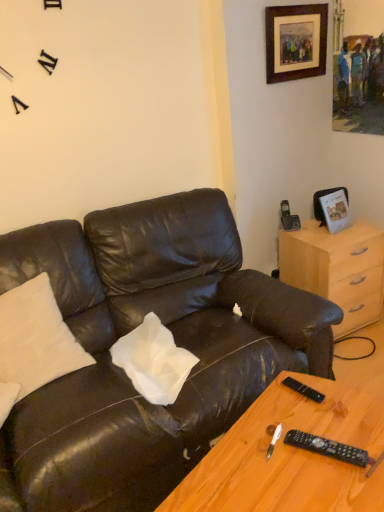
Where is `light wood/finish dresser at right`? The height and width of the screenshot is (512, 384). light wood/finish dresser at right is located at coordinates coord(337,269).

What do you see at coordinates (328, 448) in the screenshot? The image size is (384, 512). I see `black plastic remote at lower right, acting as the 1th remote starting from the front` at bounding box center [328, 448].

What do you see at coordinates (134, 328) in the screenshot? I see `matte black leather couch at center` at bounding box center [134, 328].

Image resolution: width=384 pixels, height=512 pixels. Describe the element at coordinates (290, 455) in the screenshot. I see `wooden table at lower right` at that location.

How much space does metallic silver photo frame at upper right, the second picture frame in the top-to-bottom sequence, occupy vertically?

metallic silver photo frame at upper right, the second picture frame in the top-to-bottom sequence, is 25.05 centimeters tall.

In order to face black plastic remote at lower right, which is the first remote in top-to-bottom order, should I rotate leftwards or rightwards?

A 14.716 degree turn to the right will do.

Locate an element on the screen. This screenshot has height=512, width=384. light wood/finish dresser at right is located at coordinates click(337, 269).

How many degrees apart are the facing directions of matte black leather couch at center and metallic silver photo frame at upper right, the second picture frame in the top-to-bottom sequence?

matte black leather couch at center and metallic silver photo frame at upper right, the second picture frame in the top-to-bottom sequence, are facing 3.97 degrees away from each other.

Which is correct: matte black leather couch at center is inside metallic silver photo frame at upper right, the first picture frame positioned from the bottom, or outside of it?

matte black leather couch at center cannot be found inside metallic silver photo frame at upper right, the first picture frame positioned from the bottom.

Is matte black leather couch at center placed right next to metallic silver photo frame at upper right, the first picture frame positioned from the bottom?

matte black leather couch at center and metallic silver photo frame at upper right, the first picture frame positioned from the bottom, are clearly separated.

Could you tell me if light wood/finish dresser at right is facing wooden table at lower right?

No, light wood/finish dresser at right is not facing towards wooden table at lower right.

In the image, is light wood/finish dresser at right positioned in front of or behind wooden table at lower right?

Visually, light wood/finish dresser at right is located behind wooden table at lower right.

Is light wood/finish dresser at right bigger than wooden table at lower right?

Actually, light wood/finish dresser at right might be smaller than wooden table at lower right.

Can we say light wood/finish dresser at right lies outside wooden table at lower right?

Yes.

From the image's perspective, which object appears higher, wooden table at lower right or black plastic remote at lower right, which is the second remote from top to bottom?

black plastic remote at lower right, which is the second remote from top to bottom, from the image's perspective.

Could you tell me if wooden table at lower right is turned towards black plastic remote at lower right, placed as the first remote when sorted from bottom to top?

No.

Which is behind, point (347, 401) or point (309, 449)?

The point (347, 401) is farther from the camera.

From the image's perspective, which is below, matte black leather couch at center or black plastic remote at lower right, positioned as the 2th remote in bottom-to-top order?

black plastic remote at lower right, positioned as the 2th remote in bottom-to-top order, appears lower in the image.

Considering the sizes of matte black leather couch at center and black plastic remote at lower right, which is the second remote from front to back, in the image, is matte black leather couch at center taller or shorter than black plastic remote at lower right, which is the second remote from front to back,?

Considering their sizes, matte black leather couch at center has more height than black plastic remote at lower right, which is the second remote from front to back.

Considering the sizes of objects matte black leather couch at center and black plastic remote at lower right, which is the second remote from front to back, in the image provided, who is bigger, matte black leather couch at center or black plastic remote at lower right, which is the second remote from front to back,?

matte black leather couch at center.

Is matte black leather couch at center touching black plastic remote at lower right, which is the second remote from front to back?

No, matte black leather couch at center is not with black plastic remote at lower right, which is the second remote from front to back.

Which of these two, wooden table at lower right or white soft pillow at upper left, is thinner?

white soft pillow at upper left.

Looking at this image, from the image's perspective, is wooden table at lower right located above or below white soft pillow at upper left?

wooden table at lower right is below white soft pillow at upper left.

Considering the relative positions of wooden table at lower right and white soft pillow at upper left in the image provided, is wooden table at lower right to the right of white soft pillow at upper left from the viewer's perspective?

Correct, you'll find wooden table at lower right to the right of white soft pillow at upper left.

Which object is closer to the camera, wooden table at lower right or white soft pillow at upper left?

wooden table at lower right.

Can you tell me how much metallic silver photo frame at upper right, the second picture frame in the top-to-bottom sequence, and matte black leather couch at center differ in facing direction?

metallic silver photo frame at upper right, the second picture frame in the top-to-bottom sequence, and matte black leather couch at center are facing 3.97 degrees away from each other.

From the image's perspective, which one is positioned higher, metallic silver photo frame at upper right, the second picture frame in the top-to-bottom sequence, or matte black leather couch at center?

metallic silver photo frame at upper right, the second picture frame in the top-to-bottom sequence, from the image's perspective.

Between metallic silver photo frame at upper right, the second picture frame in the top-to-bottom sequence, and matte black leather couch at center, which one appears on the right side from the viewer's perspective?

metallic silver photo frame at upper right, the second picture frame in the top-to-bottom sequence, is more to the right.

Is metallic silver photo frame at upper right, the first picture frame positioned from the bottom, turned away from matte black leather couch at center?

metallic silver photo frame at upper right, the first picture frame positioned from the bottom, does not have its back to matte black leather couch at center.

How much distance is there between light wood/finish dresser at right and matte black leather couch at center?

They are 30.55 inches apart.

Considering the sizes of objects light wood/finish dresser at right and matte black leather couch at center in the image provided, who is smaller, light wood/finish dresser at right or matte black leather couch at center?

With smaller size is light wood/finish dresser at right.

Considering the relative sizes of light wood/finish dresser at right and matte black leather couch at center in the image provided, is light wood/finish dresser at right taller than matte black leather couch at center?

No.

From a real-world perspective, which is physically above, light wood/finish dresser at right or matte black leather couch at center?

In real-world perspective, matte black leather couch at center is above.

Where is `the 1st picture frame directly above the matte black leather couch at center (from a real-world perspective)`? the 1st picture frame directly above the matte black leather couch at center (from a real-world perspective) is located at coordinates (332, 208).

Find the location of `cabinetry that is on the right side of wooden table at lower right`. cabinetry that is on the right side of wooden table at lower right is located at coordinates (337, 269).

From the image, which object appears to be nearer to matte black leather couch at center, white soft pillow at upper left or light wood/finish dresser at right?

Based on the image, white soft pillow at upper left appears to be nearer to matte black leather couch at center.

Which object lies further to the anchor point black plastic remote at lower right, which is the second remote from top to bottom, wooden table at lower right or light wood/finish dresser at right?

light wood/finish dresser at right is further to black plastic remote at lower right, which is the second remote from top to bottom.

From the image, which object appears to be farther from metallic silver photo frame at upper right, the second picture frame in the top-to-bottom sequence, black plastic remote at lower right, acting as the second remote starting from the back, or black plastic remote at lower right, positioned as the 2th remote in bottom-to-top order?

black plastic remote at lower right, acting as the second remote starting from the back, is further to metallic silver photo frame at upper right, the second picture frame in the top-to-bottom sequence.

Which object lies further to the anchor point white soft pillow at upper left, wooden framed artwork at upper right, the 1th picture frame in the top-to-bottom sequence, or matte black leather couch at center?

Among the two, wooden framed artwork at upper right, the 1th picture frame in the top-to-bottom sequence, is located further to white soft pillow at upper left.

When comparing their distances from wooden table at lower right, does black plastic remote at lower right, acting as the second remote starting from the back, or light wood/finish dresser at right seem further?

light wood/finish dresser at right is positioned further to the anchor wooden table at lower right.

From the image, which object appears to be farther from matte black leather couch at center, wooden table at lower right or wooden framed artwork at upper right, the 1th picture frame in the top-to-bottom sequence?

Among the two, wooden framed artwork at upper right, the 1th picture frame in the top-to-bottom sequence, is located further to matte black leather couch at center.

Considering their positions, is metallic silver photo frame at upper right, the first picture frame positioned from the bottom, positioned further to matte black leather couch at center than light wood/finish dresser at right?

Based on the image, metallic silver photo frame at upper right, the first picture frame positioned from the bottom, appears to be further to matte black leather couch at center.

Looking at the image, which one is located further to matte black leather couch at center, white soft pillow at upper left or metallic silver photo frame at upper right, the second picture frame in the top-to-bottom sequence?

The object further to matte black leather couch at center is metallic silver photo frame at upper right, the second picture frame in the top-to-bottom sequence.

Where is `pillow that lies between wooden framed artwork at upper right, the 1th picture frame in the top-to-bottom sequence, and matte black leather couch at center from top to bottom`? pillow that lies between wooden framed artwork at upper right, the 1th picture frame in the top-to-bottom sequence, and matte black leather couch at center from top to bottom is located at coordinates (36, 338).

Image resolution: width=384 pixels, height=512 pixels. What are the coordinates of `studio couch between white soft pillow at upper left and black plastic remote at lower right, arranged as the 1th remote when viewed from the back, in the horizontal direction` in the screenshot? It's located at (134, 328).

Image resolution: width=384 pixels, height=512 pixels. What are the coordinates of `pillow between wooden table at lower right and metallic silver photo frame at upper right, the second picture frame in the top-to-bottom sequence, in the front-back direction` in the screenshot? It's located at (36, 338).

The image size is (384, 512). In order to click on cabinetry between wooden framed artwork at upper right, the second picture frame in the bottom-to-top sequence, and matte black leather couch at center in the up-down direction in this screenshot , I will do pyautogui.click(x=337, y=269).